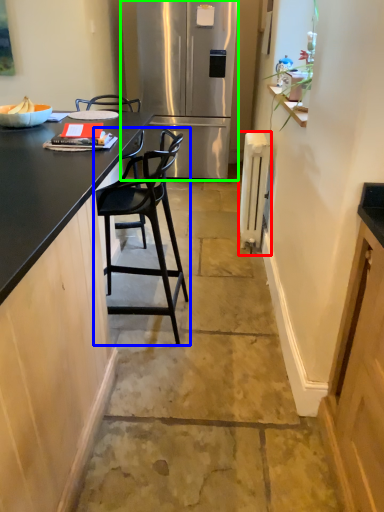
Question: Estimate the real-world distances between objects in this image. Which object is closer to appliance (highlighted by a red box), chair (highlighted by a blue box) or refrigerator (highlighted by a green box)?

Choices:
 (A) chair
 (B) refrigerator

Answer: (A)